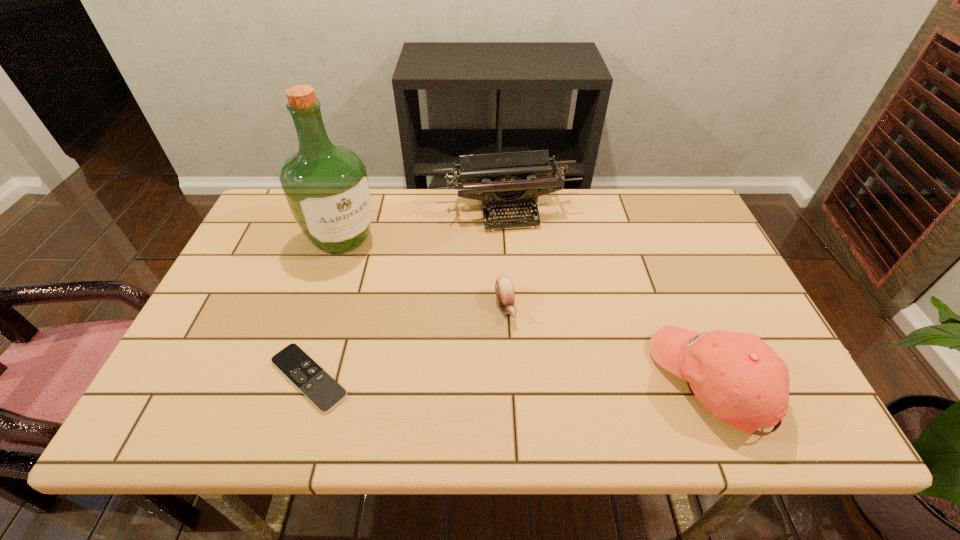
Where is `free spot on the desktop that is between the shortest object and the rightmost object and is positioned on the front-facing side of the liquor`? The height and width of the screenshot is (540, 960). free spot on the desktop that is between the shortest object and the rightmost object and is positioned on the front-facing side of the liquor is located at coordinates (462, 379).

Find the location of `free space on the desktop that is between the remote control and the baseball cap and is positioned on the front-facing side of the third farthest object`. free space on the desktop that is between the remote control and the baseball cap and is positioned on the front-facing side of the third farthest object is located at coordinates (532, 380).

Identify the location of free space on the desktop that is between the remote control and the baseball cap and is positioned on the typing side of the typewriter. click(546, 380).